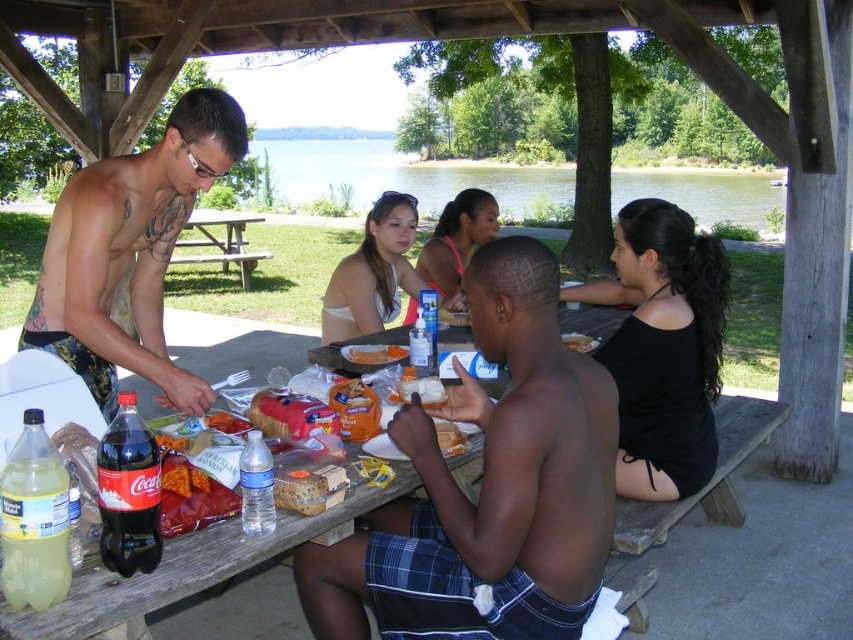
You are planning to set up a large umbrella on the wooden picnic table at center. Considering the size of the table, will the umbrella block the view of the green water at upper center from the people sitting around the table?

The wooden picnic table at center has a smaller size compared to green water at upper center. Since the table is smaller, the umbrella placed on it would not block the entire view of the green water at upper center, allowing people to still see parts of it.

You are standing at the center of the picnic table and want to pass a napkin to the person wearing the shiny black shorts at left. In which direction should you move relative to the picnic table?

The shiny black shorts at left is located at point 0.394 on the x axis and 0.154 on the y axis. Since you are at the center, you should move towards the left side of the picnic table to reach the person wearing the shiny black shorts at left.